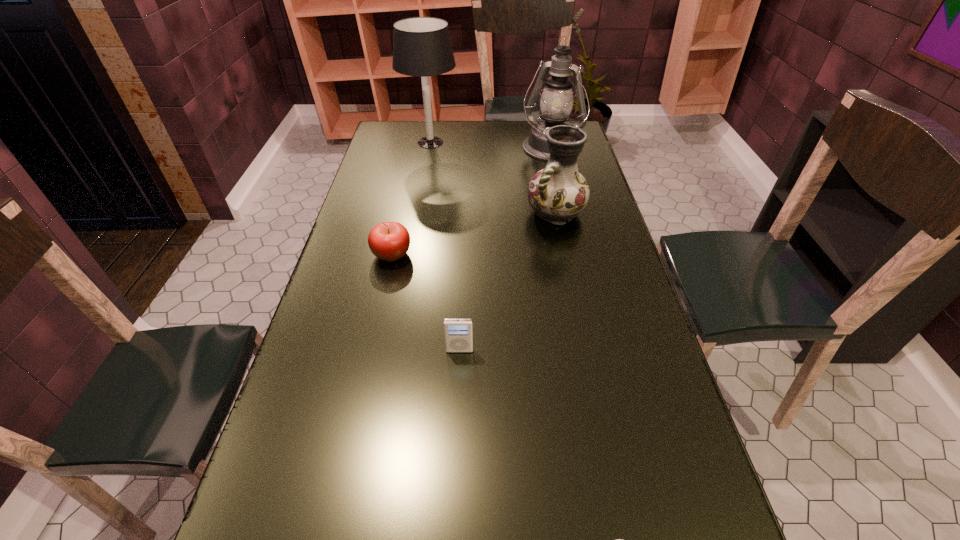
The width and height of the screenshot is (960, 540). I want to click on table lamp, so click(422, 47).

I want to click on oil lamp, so click(556, 103).

I want to click on the fourth shortest object, so click(x=557, y=193).

What are the coordinates of `vase` in the screenshot? It's located at (557, 193).

Identify the location of apple. (389, 241).

The width and height of the screenshot is (960, 540). I want to click on iPod, so click(458, 333).

Image resolution: width=960 pixels, height=540 pixels. In order to click on the third object from left to right in this screenshot , I will do `click(458, 333)`.

Where is `free spot located on the front of the table lamp`? free spot located on the front of the table lamp is located at coordinates (419, 213).

At what (x,y) coordinates should I click in order to perform the action: click on vacant space located on the left of the oil lamp. Please return your answer as a coordinate pair (x, y). This screenshot has width=960, height=540. Looking at the image, I should click on (473, 150).

Image resolution: width=960 pixels, height=540 pixels. Identify the location of vacant space located on the back of the fourth shortest object. (540, 141).